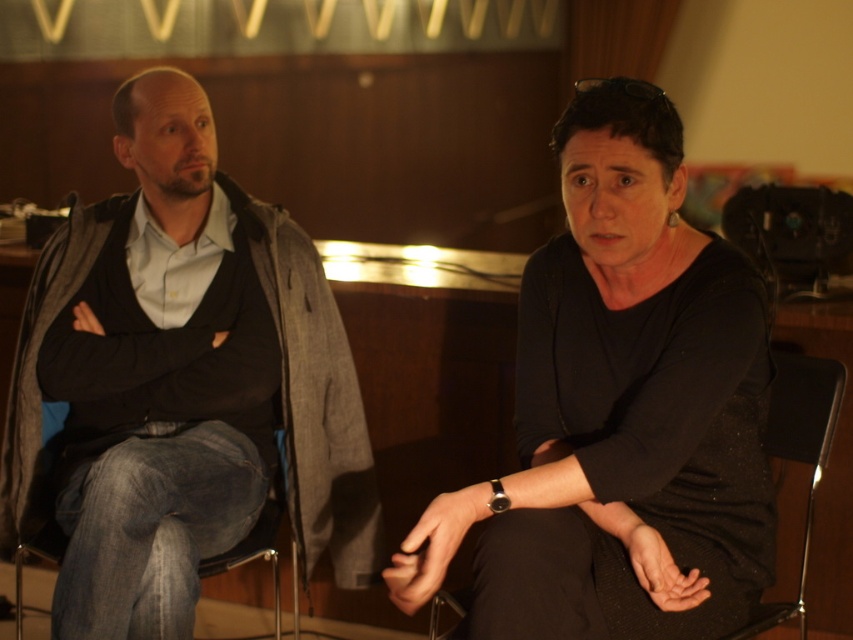
Question: Which point is farther to the camera?

Choices:
 (A) (743, 394)
 (B) (788, 410)
 (C) (247, 339)

Answer: (C)

Question: Is the position of black matte shirt at center more distant than that of black fabric chair at center?

Choices:
 (A) no
 (B) yes

Answer: (A)

Question: In this image, where is black fabric chair at center located relative to denim fabric at left?

Choices:
 (A) left
 (B) right

Answer: (B)

Question: Can you confirm if black matte shirt at center is positioned below dark gray sweater at left?

Choices:
 (A) no
 (B) yes

Answer: (B)

Question: Which of the following is the closest to the observer?

Choices:
 (A) black matte shirt at center
 (B) dark gray sweater at left
 (C) black fabric chair at center
 (D) denim fabric at left

Answer: (A)

Question: Which object appears closest to the camera in this image?

Choices:
 (A) black fabric chair at center
 (B) black matte shirt at center

Answer: (B)